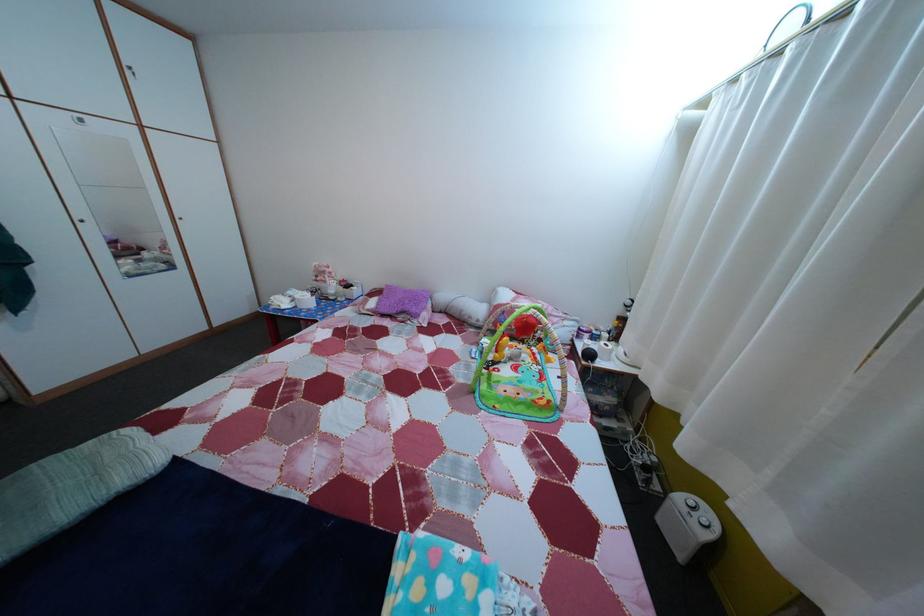
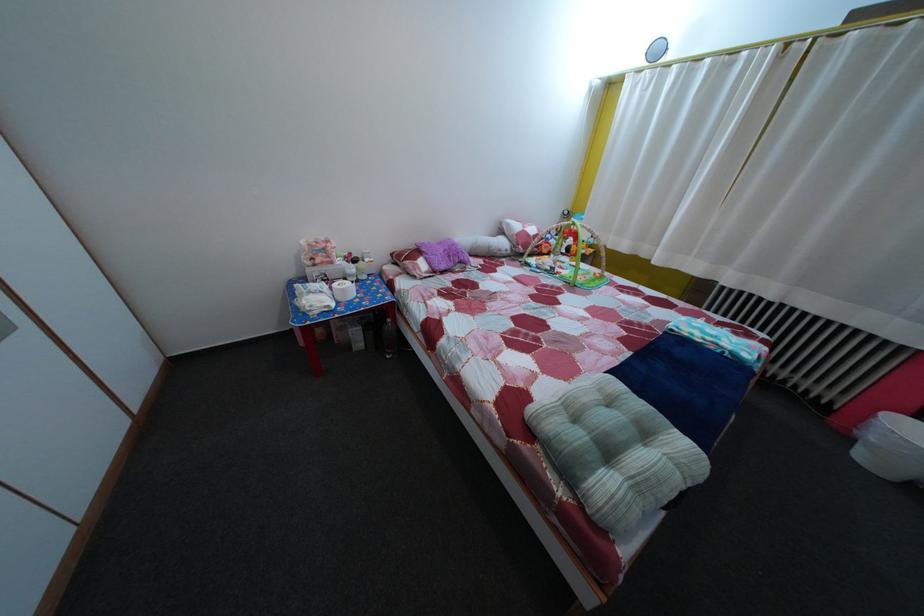
Locate, in the second image, the point that corresponds to point (240, 469) in the first image.

(601, 379)